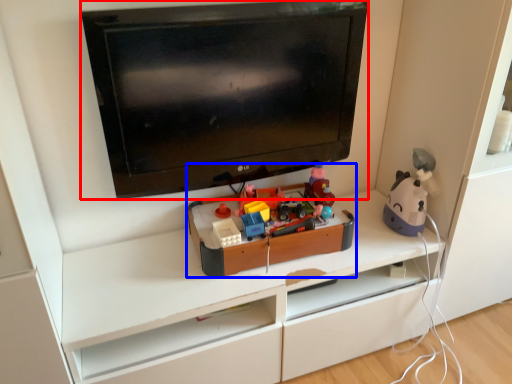
Question: Which of the following is the farthest to the observer, television (highlighted by a red box) or toy (highlighted by a blue box)?

Choices:
 (A) television
 (B) toy

Answer: (B)